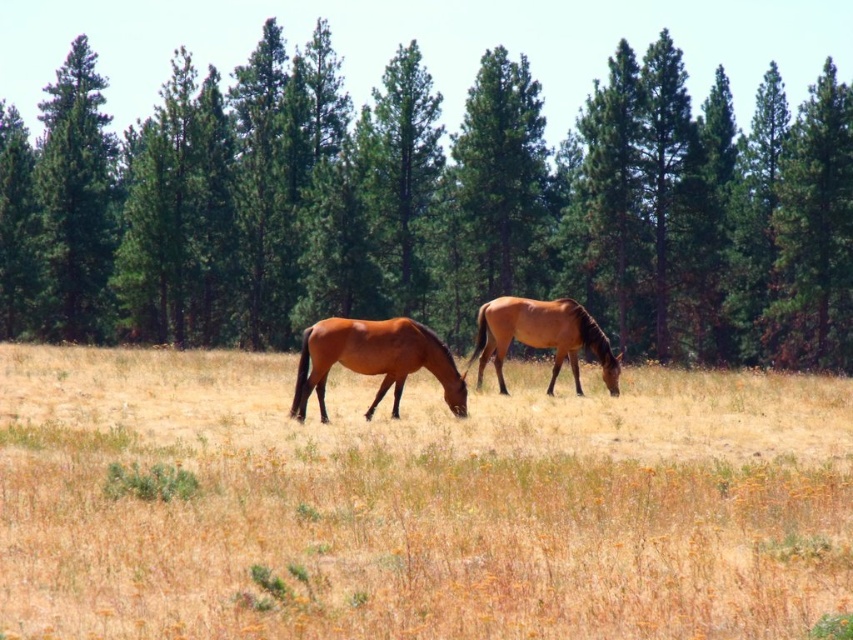
You are standing in the field and want to walk from point A to point B. Point A is at coordinate (x=717, y=250) and point B is at coordinate (x=544, y=310). Which point is closer to you when you start at point A?

Point B at coordinate (x=544, y=310) is closer to you because it is nearer to the camera than point A at coordinate (x=717, y=250).